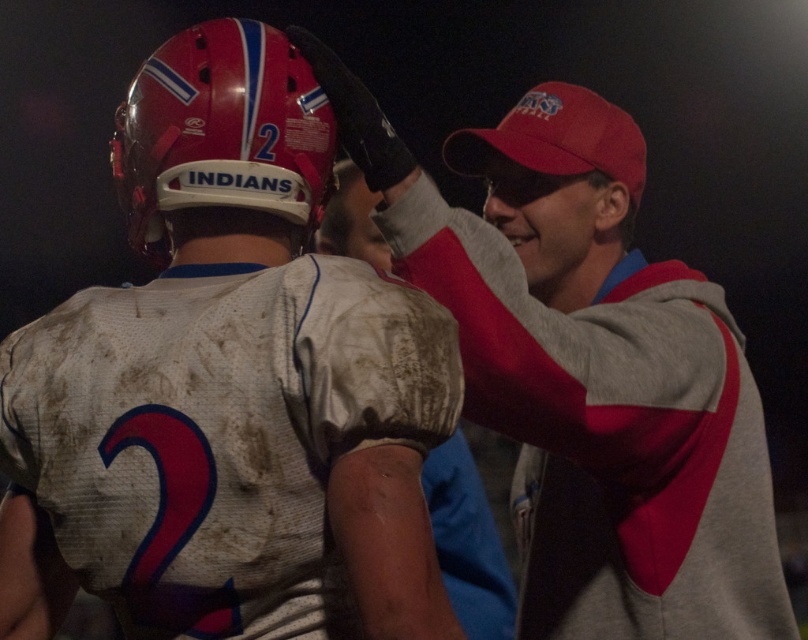
Question: Estimate the real-world distances between objects in this image. Which object is closer to the matte white jersey at center?

Choices:
 (A) gray/red hoodie at upper right
 (B) white matte jersey at upper right
 (C) matte red helmet at upper left

Answer: (C)

Question: Is matte red helmet at upper left thinner than gray/red hoodie at upper right?

Choices:
 (A) yes
 (B) no

Answer: (B)

Question: In this image, where is matte red helmet at upper left located relative to gray/red hoodie at upper right?

Choices:
 (A) left
 (B) right

Answer: (A)

Question: Is matte red helmet at upper left to the right of gray/red hoodie at upper right from the viewer's perspective?

Choices:
 (A) yes
 (B) no

Answer: (B)

Question: Which of these objects is positioned closest to the matte white jersey at center?

Choices:
 (A) matte red helmet at upper left
 (B) white matte jersey at upper right
 (C) gray/red hoodie at upper right

Answer: (A)

Question: Estimate the real-world distances between objects in this image. Which object is closer to the matte white jersey at center?

Choices:
 (A) matte red helmet at upper left
 (B) white matte jersey at upper right
 (C) gray/red hoodie at upper right

Answer: (A)